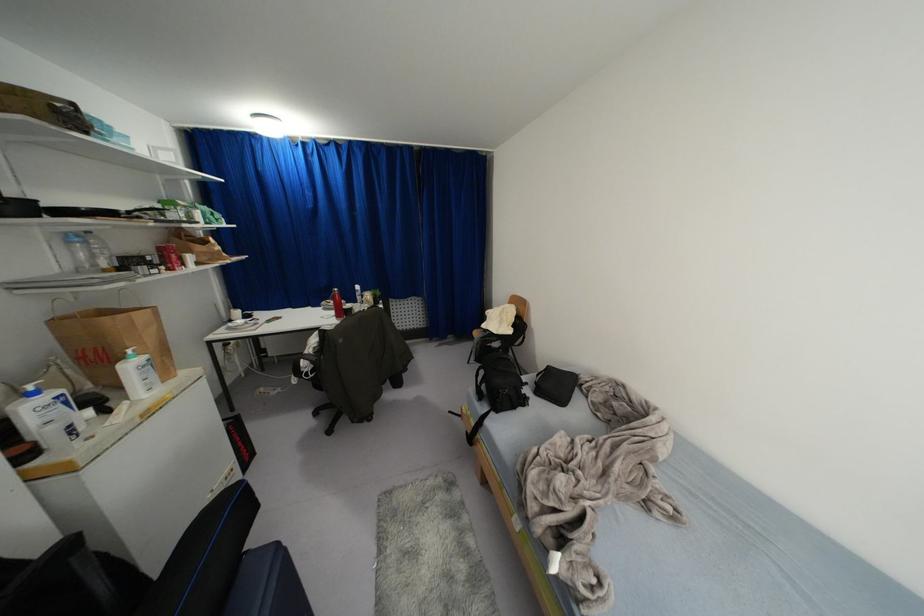
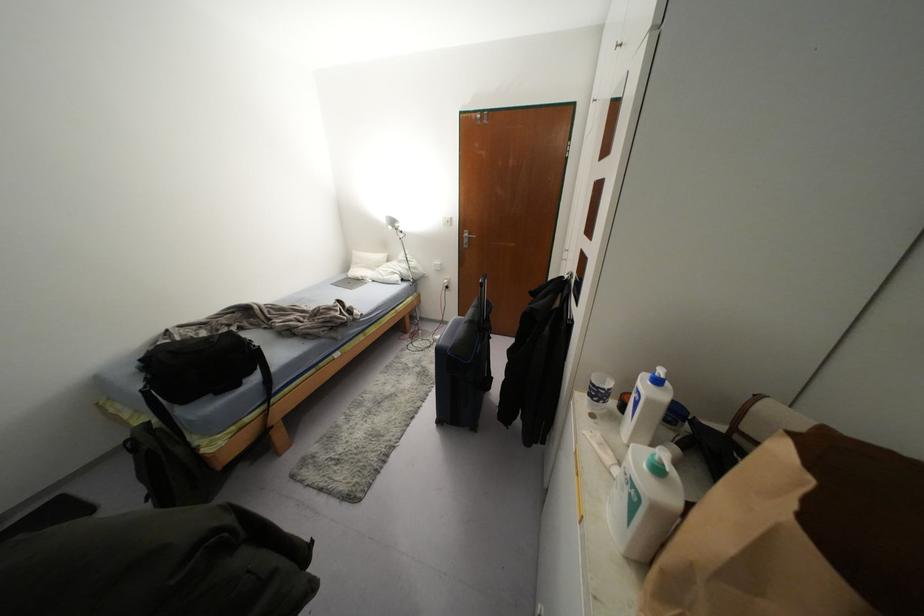
Locate, in the second image, the point that corresponds to point 35,392 in the first image.

(658, 381)